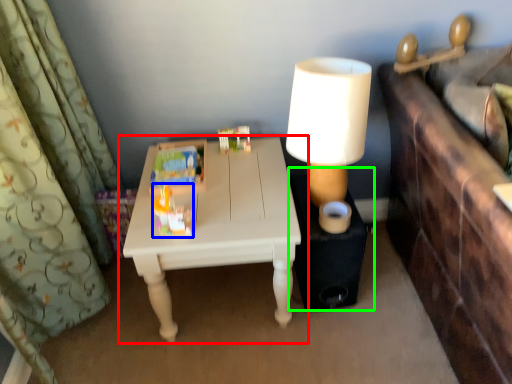
Question: Estimate the real-world distances between objects in this image. Which object is farther from table (highlighted by a red box), toy (highlighted by a blue box) or side table (highlighted by a green box)?

Choices:
 (A) toy
 (B) side table

Answer: (B)